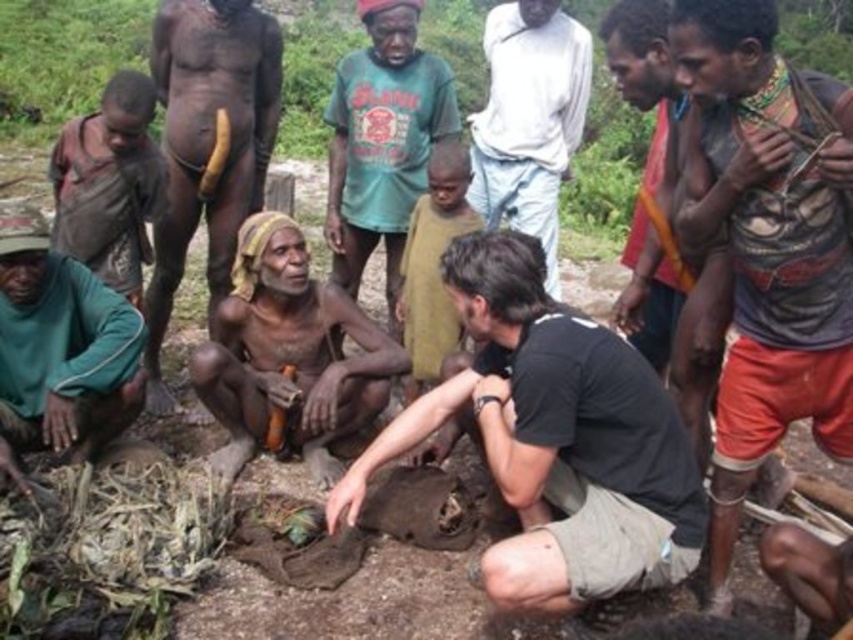
Question: Which point is closer to the camera?

Choices:
 (A) (350, 429)
 (B) (537, 154)
 (C) (677, 513)

Answer: (C)

Question: Does brown skin man at center appear on the left side of white cotton shirt at upper center?

Choices:
 (A) yes
 (B) no

Answer: (A)

Question: Among these points, which one is farthest from the camera?

Choices:
 (A) (486, 173)
 (B) (544, 349)
 (C) (196, 106)
 (D) (300, 378)

Answer: (A)

Question: Can you confirm if black cotton shirt at center is smaller than brown rough skin at center?

Choices:
 (A) yes
 (B) no

Answer: (B)

Question: Where is black cotton shirt at center located in relation to brown rough skin at center in the image?

Choices:
 (A) below
 (B) above

Answer: (A)

Question: Which object is positioned farthest from the brown rough skin at center?

Choices:
 (A) white cotton shirt at upper center
 (B) brown skin man at center

Answer: (A)